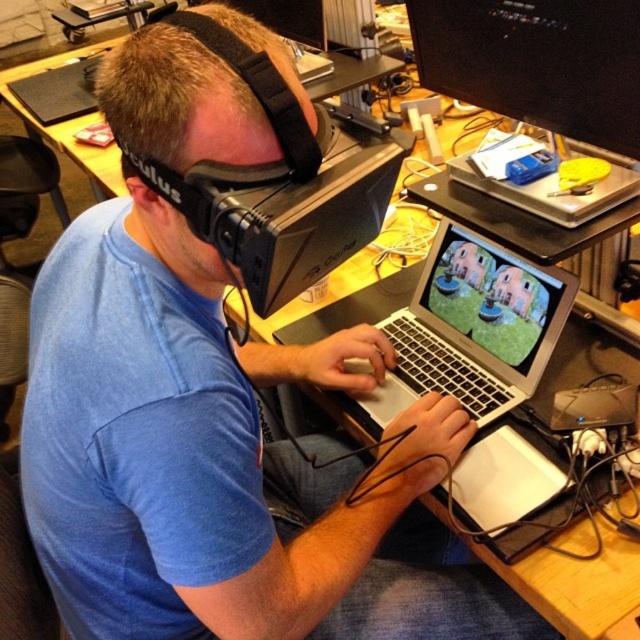
Question: Observing the image, what is the correct spatial positioning of black glossy monitor at upper center in reference to silver metallic laptop at center?

Choices:
 (A) left
 (B) right

Answer: (B)

Question: Which point is closer to the camera taking this photo?

Choices:
 (A) (576, 284)
 (B) (529, 33)

Answer: (B)

Question: Which point is closer to the camera?

Choices:
 (A) black glossy monitor at upper center
 (B) silver metallic laptop at center

Answer: (A)

Question: Does black glossy monitor at upper center appear over silver metallic laptop at center?

Choices:
 (A) no
 (B) yes

Answer: (B)

Question: Does black glossy monitor at upper center have a lesser width compared to silver metallic laptop at center?

Choices:
 (A) yes
 (B) no

Answer: (A)